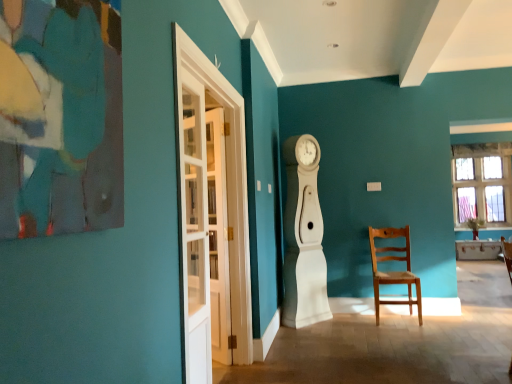
Question: Considering their positions, is clear glass window at upper right located in front of or behind white glass door at left, the 2th glass door from the back?

Choices:
 (A) behind
 (B) front

Answer: (A)

Question: Visually, is clear glass window at upper right positioned to the left or to the right of white glass door at left, the 2th glass door from the back?

Choices:
 (A) left
 (B) right

Answer: (B)

Question: Estimate the real-world distances between objects in this image. Which object is closer to the white glass door at left, the 2th glass door from the back?

Choices:
 (A) white glass door at left, marked as the 2th glass door in a front-to-back arrangement
 (B) clear glass window at upper right
 (C) light brown wooden chair at center right
 (D) white wooden door at left

Answer: (A)

Question: Considering the real-world distances, which object is closest to the clear glass window at upper right?

Choices:
 (A) light brown wooden chair at center right
 (B) white glass door at left, the 2th glass door from the back
 (C) white wooden door at left
 (D) white glass door at left, the first glass door in the back-to-front sequence

Answer: (A)